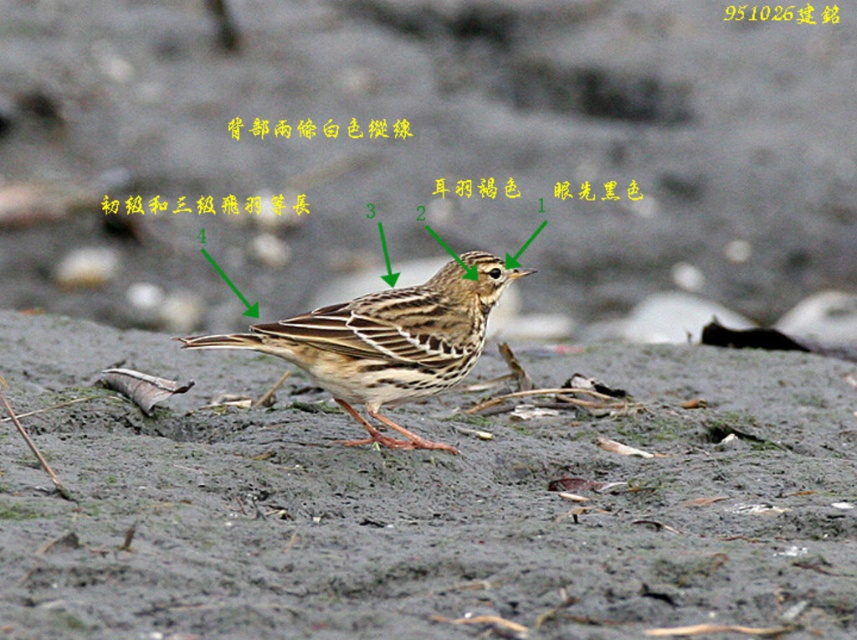
Is point (477, 397) more distant than point (355, 412)?

Yes.

From the picture: Does brown matte mud at center appear on the right side of brown speckled bird at center?

In fact, brown matte mud at center is to the left of brown speckled bird at center.

Identify the location of brown matte mud at center. (424, 500).

Image resolution: width=857 pixels, height=640 pixels. I want to click on brown matte mud at center, so click(x=424, y=500).